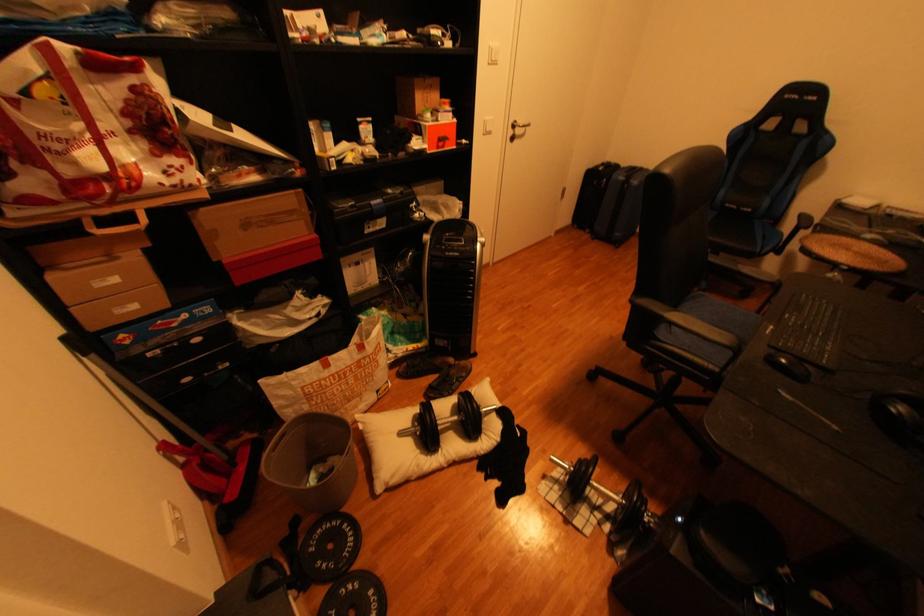
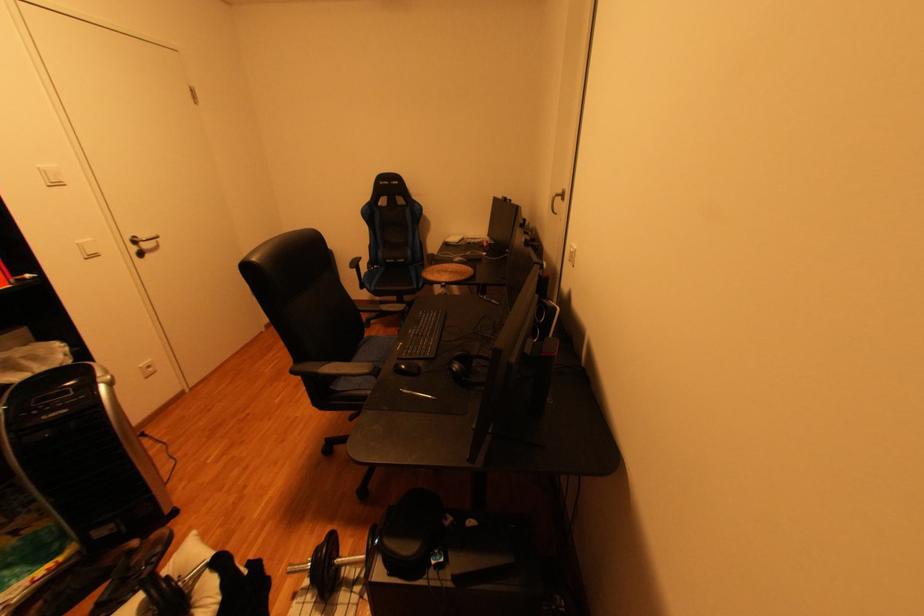
Question: The camera is either moving clockwise (left) or counter-clockwise (right) around the object. The first image is from the beginning of the video and the second image is from the end. Is the camera moving left or right when shooting the video?

Choices:
 (A) Left
 (B) Right

Answer: (A)